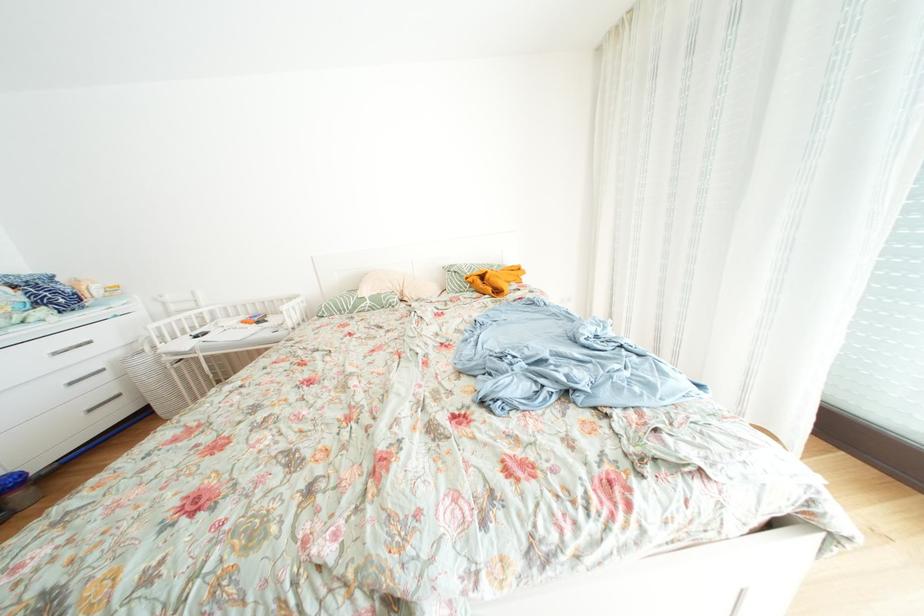
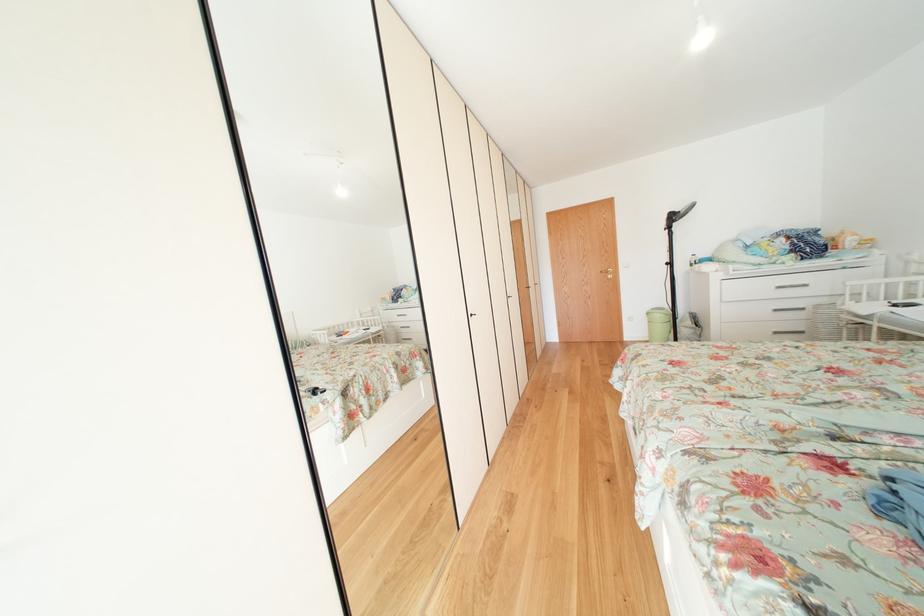
In the second image, find the point that corresponds to point 80,389 in the first image.

(784, 315)